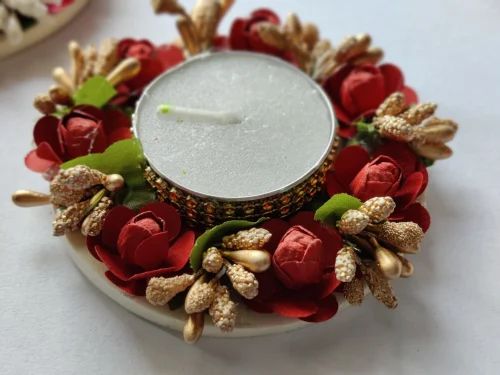
This screenshot has height=375, width=500. Find the location of `space to the left of candle holder`. space to the left of candle holder is located at coordinates (12, 235).